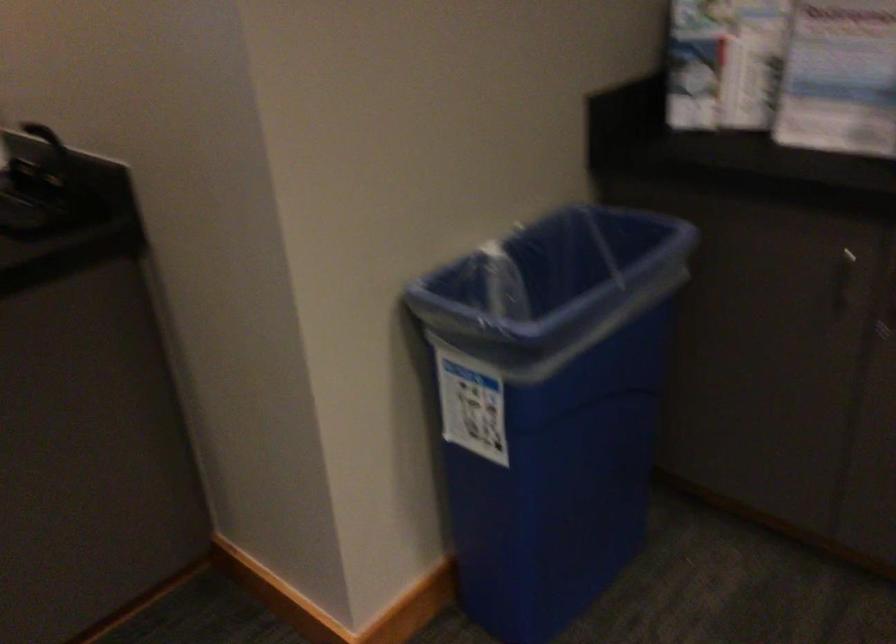
In order to click on blue trash can rim in this screenshot , I will do `click(556, 281)`.